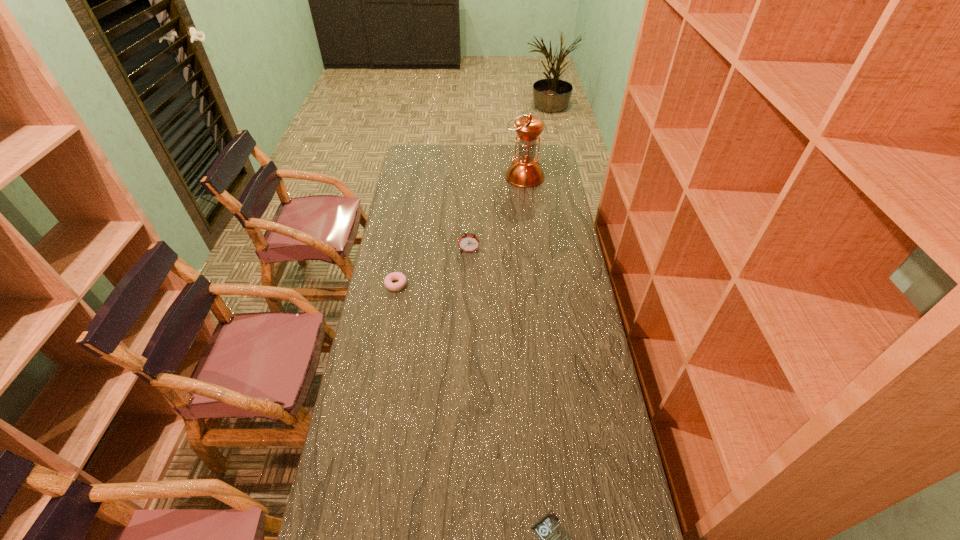
You are a GUI agent. You are given a task and a screenshot of the screen. Output one action in this format:
    pyautogui.click(x=<x>, y=<y>)
    Task: Click on the object that is at the left edge
    
    Given the screenshot: What is the action you would take?
    pyautogui.click(x=402, y=281)

Locate an element on the screen. The width and height of the screenshot is (960, 540). object that is at the right edge is located at coordinates (525, 171).

Image resolution: width=960 pixels, height=540 pixels. Identify the location of object at the far right corner. (525, 171).

In the image, there is a desktop. Identify the location of vacant space at the far edge. The width and height of the screenshot is (960, 540). click(x=494, y=164).

I want to click on vacant space at the left edge, so click(398, 207).

Identify the location of vacant space at the right edge of the desktop. (554, 239).

The width and height of the screenshot is (960, 540). I want to click on free spot between the second farthest object and the farthest object, so click(x=496, y=214).

The image size is (960, 540). Identify the location of object that is the third closest to the nearest object. (525, 171).

Locate an element on the screen. This screenshot has height=540, width=960. object that ranks as the closest to the oil lamp is located at coordinates (468, 242).